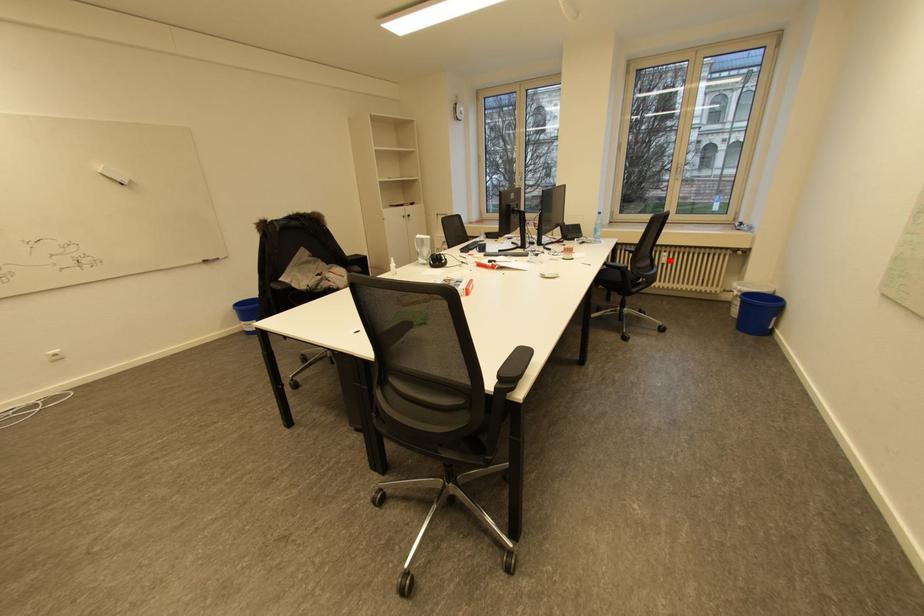
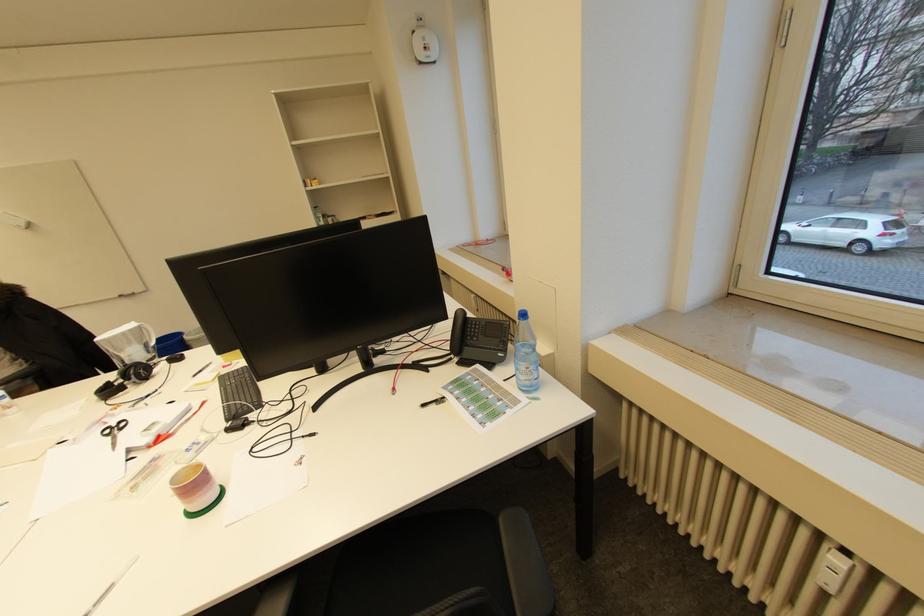
Question: I am providing you with two images of the same scene from different viewpoints. Given a red point in image1, look at the same physical point in image2. Is it:

Choices:
 (A) Closer to the viewpoint
 (B) Farther from the viewpoint

Answer: (A)